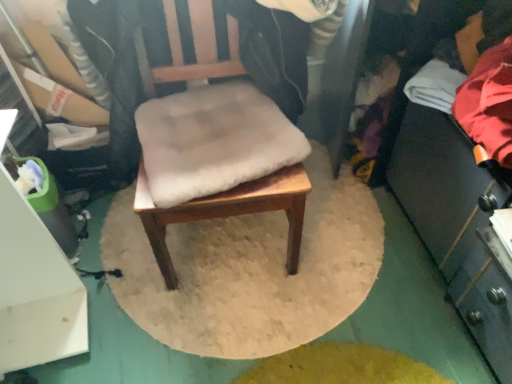
At what (x,y) coordinates should I click in order to perform the action: click on white soft cushion at center. Please return your answer as a coordinate pair (x, y). This screenshot has height=384, width=512. Looking at the image, I should click on (213, 141).

Describe the element at coordinates (489, 103) in the screenshot. I see `red fabric at right` at that location.

The width and height of the screenshot is (512, 384). What are the coordinates of `red fabric at right` in the screenshot? It's located at (489, 103).

Identify the location of white soft cushion at center. (213, 141).

Looking at this image, is white soft cushion at center directly adjacent to wooden chair at center?

No, white soft cushion at center is not in contact with wooden chair at center.

Considering the sizes of objects white soft cushion at center and wooden chair at center in the image provided, who is shorter, white soft cushion at center or wooden chair at center?

With less height is white soft cushion at center.

Is white soft cushion at center not within wooden chair at center?

No, white soft cushion at center is not entirely external to wooden chair at center.

Locate an element on the screen. clothing that is above the wooden chair at center (from a real-world perspective) is located at coordinates (489, 103).

Is wooden chair at center next to red fabric at right and touching it?

wooden chair at center and red fabric at right are clearly separated.

Which is more to the right, wooden chair at center or red fabric at right?

From the viewer's perspective, red fabric at right appears more on the right side.

Consider the image. Can you confirm if wooden chair at center is wider than red fabric at right?

Correct, the width of wooden chair at center exceeds that of red fabric at right.

Are red fabric at right and wooden chair at center located far from each other?

No, red fabric at right is in close proximity to wooden chair at center.

Considering the positions of points (496, 136) and (289, 241), is point (496, 136) farther from camera compared to point (289, 241)?

No, (496, 136) is in front of (289, 241).

Based on the photo, from the image's perspective, which object appears higher, red fabric at right or wooden chair at center?

red fabric at right appears higher in the image.

Is red fabric at right taller or shorter than wooden chair at center?

In the image, red fabric at right appears to be shorter than wooden chair at center.

How far apart are white soft cushion at center and red fabric at right?

A distance of 22.32 inches exists between white soft cushion at center and red fabric at right.

Is white soft cushion at center next to red fabric at right and touching it?

No.

Is white soft cushion at center at the right side of red fabric at right?

No.

From a real-world perspective, is white soft cushion at center beneath red fabric at right?

Yes, from a real-world perspective, white soft cushion at center is under red fabric at right.

Considering the relative sizes of red fabric at right and white soft cushion at center in the image provided, is red fabric at right thinner than white soft cushion at center?

Indeed, red fabric at right has a lesser width compared to white soft cushion at center.

Which is behind, point (505, 108) or point (177, 163)?

Positioned behind is point (177, 163).

Is white soft cushion at center surrounded by red fabric at right?

That's incorrect, white soft cushion at center is not inside red fabric at right.

From the image's perspective, which one is positioned higher, red fabric at right or white soft cushion at center?

red fabric at right is shown above in the image.

How much distance is there between wooden chair at center and white soft cushion at center?

5.85 inches.

From the image's perspective, does wooden chair at center appear higher than white soft cushion at center?

Yes, from the image's perspective, wooden chair at center is on top of white soft cushion at center.

Does point (234, 212) come behind point (232, 81)?

No, (234, 212) is closer to viewer.

Can you confirm if wooden chair at center is positioned to the right of white soft cushion at center?

Yes.

This screenshot has height=384, width=512. Identify the location of footrest below the wooden chair at center (from a real-world perspective). (213, 141).

The width and height of the screenshot is (512, 384). What are the coordinates of `clothing above the wooden chair at center (from a real-world perspective)` in the screenshot? It's located at (489, 103).

Looking at the image, which one is located closer to wooden chair at center, red fabric at right or white soft cushion at center?

white soft cushion at center is positioned closer to the anchor wooden chair at center.

Looking at the image, which one is located closer to white soft cushion at center, wooden chair at center or red fabric at right?

Based on the image, wooden chair at center appears to be nearer to white soft cushion at center.

From the image, which object appears to be nearer to red fabric at right, white soft cushion at center or wooden chair at center?

wooden chair at center.

Considering their positions, is wooden chair at center positioned closer to red fabric at right than white soft cushion at center?

wooden chair at center lies closer to red fabric at right than the other object.

From the image, which object appears to be farther from wooden chair at center, white soft cushion at center or red fabric at right?

red fabric at right.

Based on their spatial positions, is red fabric at right or wooden chair at center further from white soft cushion at center?

red fabric at right is further to white soft cushion at center.

Identify the location of chair between white soft cushion at center and red fabric at right in the horizontal direction. (228, 212).